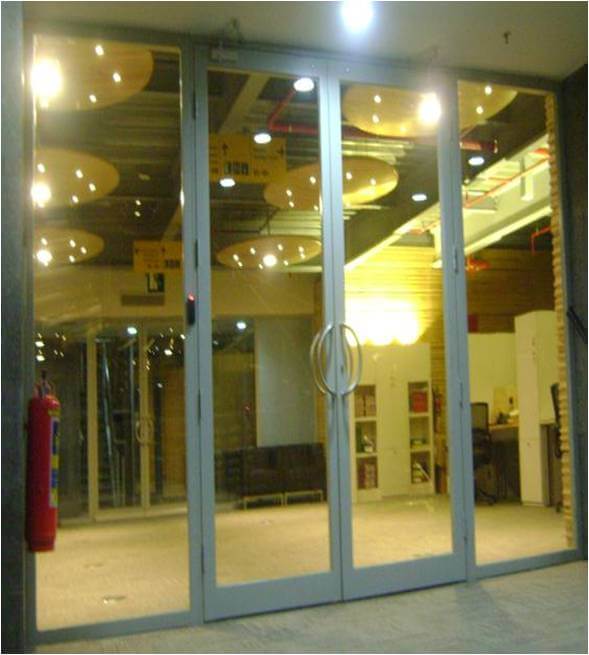
The width and height of the screenshot is (589, 655). I want to click on door, so click(119, 428), click(173, 414), click(269, 401), click(415, 415).